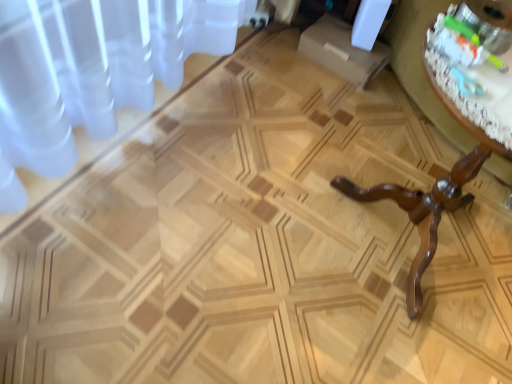
Question: Would you say translucent glass bowl at upper right is inside or outside wooden table at right?

Choices:
 (A) outside
 (B) inside

Answer: (B)

Question: Considering their positions, is translucent glass bowl at upper right located in front of or behind wooden table at right?

Choices:
 (A) behind
 (B) front

Answer: (A)

Question: From a real-world perspective, is translucent glass bowl at upper right positioned above or below wooden table at right?

Choices:
 (A) below
 (B) above

Answer: (B)

Question: Relative to translucent glass bowl at upper right, is wooden table at right in front or behind?

Choices:
 (A) behind
 (B) front

Answer: (B)

Question: Based on their positions, is wooden table at right located to the left or right of translucent glass bowl at upper right?

Choices:
 (A) left
 (B) right

Answer: (B)

Question: Is wooden table at right bigger or smaller than translucent glass bowl at upper right?

Choices:
 (A) small
 (B) big

Answer: (B)

Question: From a real-world perspective, relative to translucent glass bowl at upper right, is wooden table at right vertically above or below?

Choices:
 (A) above
 (B) below

Answer: (B)